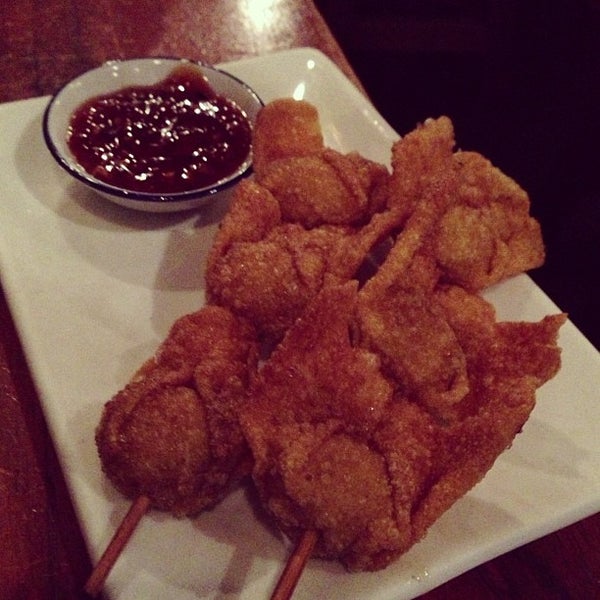
Where is `dark wood grain table top`? dark wood grain table top is located at coordinates (32, 527), (572, 577), (133, 36).